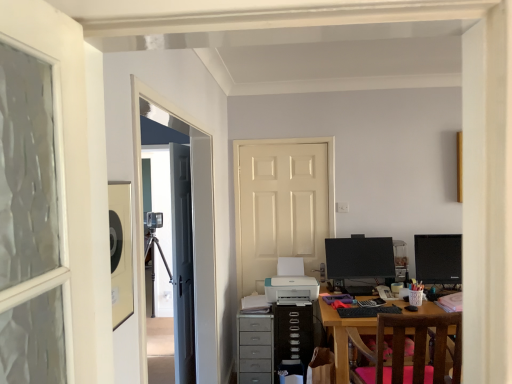
Question: Relative to black glossy monitor at right, the 1th computer monitor positioned from the right, is gray fabric drawer at center in front or behind?

Choices:
 (A) front
 (B) behind

Answer: (A)

Question: From their relative heights in the image, would you say gray fabric drawer at center is taller or shorter than black glossy monitor at right, acting as the second computer monitor starting from the left?

Choices:
 (A) tall
 (B) short

Answer: (A)

Question: Which is farther from the teal plastic printer at center?

Choices:
 (A) white glossy door at center, the first door viewed from the right
 (B) pink fabric chair at lower right
 (C) transparent glass door at upper left
 (D) gray fabric drawer at center
 (E) black glossy monitor at center, placed as the 2th computer monitor when sorted from right to left

Answer: (B)

Question: Which object is the farthest from the pink fabric chair at lower right?

Choices:
 (A) black glossy monitor at right, acting as the second computer monitor starting from the left
 (B) teal plastic printer at center
 (C) gray fabric drawer at center
 (D) black glossy monitor at center, placed as the 2th computer monitor when sorted from right to left
 (E) dark gray matte door at left, marked as the 1th door in a left-to-right arrangement

Answer: (E)